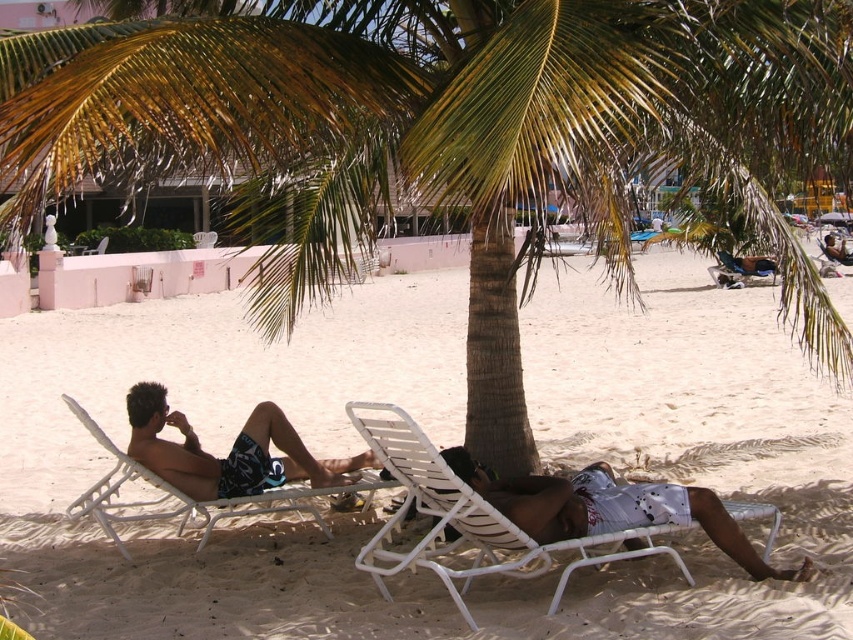
Who is more distant from viewer, [752,275] or [96,248]?

Positioned behind is point [96,248].

Does blue fabric beach chair at center have a greater width compared to white plastic chair at center?

Yes, blue fabric beach chair at center is wider than white plastic chair at center.

The height and width of the screenshot is (640, 853). Describe the element at coordinates (741, 268) in the screenshot. I see `blue fabric beach chair at center` at that location.

You are a GUI agent. You are given a task and a screenshot of the screen. Output one action in this format:
    pyautogui.click(x=<x>, y=<y>)
    Task: Click on the blue fabric beach chair at center
    The height and width of the screenshot is (640, 853).
    Given the screenshot: What is the action you would take?
    pyautogui.click(x=741, y=268)

Is white plastic chair at left bigger than white plastic chair at center?

Yes.

Which is below, white plastic chair at left or white plastic chair at center?

white plastic chair at left

Does point (299, 496) come farther from viewer compared to point (82, 250)?

That is False.

Image resolution: width=853 pixels, height=640 pixels. What are the coordinates of `white plastic chair at left` in the screenshot? It's located at (167, 493).

Is point (450, 488) positioned in front of point (134, 433)?

Yes, it is.

Is point (497, 570) closer to camera compared to point (368, 465)?

Yes, point (497, 570) is closer to viewer.

You are a GUI agent. You are given a task and a screenshot of the screen. Output one action in this format:
    pyautogui.click(x=<x>, y=<y>)
    Task: Click on the white plastic beach chair at lower center
    This screenshot has height=640, width=853.
    Given the screenshot: What is the action you would take?
    pyautogui.click(x=453, y=512)